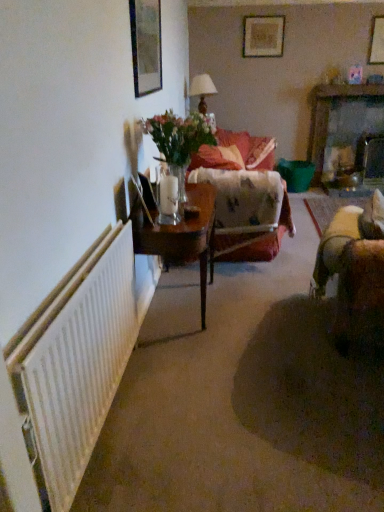
Question: From the image's perspective, would you say wooden picture frame at upper right, acting as the second picture frame starting from the back, is shown under wooden table at left?

Choices:
 (A) yes
 (B) no

Answer: (B)

Question: Is wooden picture frame at upper right, positioned as the 2th picture frame in top-to-bottom order, to the right of wooden table at left from the viewer's perspective?

Choices:
 (A) no
 (B) yes

Answer: (B)

Question: From a real-world perspective, is wooden picture frame at upper right, positioned as the 2th picture frame in top-to-bottom order, physically below wooden table at left?

Choices:
 (A) yes
 (B) no

Answer: (B)

Question: Would you say wooden picture frame at upper right, acting as the second picture frame starting from the back, is outside wooden table at left?

Choices:
 (A) no
 (B) yes

Answer: (B)

Question: From the image's perspective, is wooden picture frame at upper right, positioned as the second picture frame in bottom-to-top order, above wooden table at left?

Choices:
 (A) no
 (B) yes

Answer: (B)

Question: In terms of height, does fluffy fabric couch at center look taller or shorter compared to wooden picture frame at upper center, the 3th picture frame positioned from the front?

Choices:
 (A) tall
 (B) short

Answer: (A)

Question: Is point (274, 147) positioned closer to the camera than point (264, 38)?

Choices:
 (A) closer
 (B) farther

Answer: (B)

Question: From the image's perspective, is fluffy fabric couch at center located above or below wooden picture frame at upper center, the 3th picture frame from the bottom?

Choices:
 (A) above
 (B) below

Answer: (B)

Question: From a real-world perspective, is fluffy fabric couch at center above or below wooden picture frame at upper center, the 3th picture frame positioned from the front?

Choices:
 (A) above
 (B) below

Answer: (B)

Question: Looking at their shapes, would you say white ribbed radiator at left is wider or thinner than wooden picture frame at upper center, placed as the first picture frame when sorted from top to bottom?

Choices:
 (A) wide
 (B) thin

Answer: (A)

Question: From the image's perspective, is white ribbed radiator at left above or below wooden picture frame at upper center, the first picture frame from the back?

Choices:
 (A) above
 (B) below

Answer: (B)

Question: Is point (82, 328) positioned closer to the camera than point (276, 20)?

Choices:
 (A) farther
 (B) closer

Answer: (B)

Question: Is white ribbed radiator at left inside or outside of wooden picture frame at upper center, which ranks as the second picture frame in right-to-left order?

Choices:
 (A) outside
 (B) inside

Answer: (A)

Question: Looking at the image, does fluffy fabric couch at center seem bigger or smaller compared to white ribbed radiator at left?

Choices:
 (A) small
 (B) big

Answer: (B)

Question: In the image, is fluffy fabric couch at center on the left side or the right side of white ribbed radiator at left?

Choices:
 (A) left
 (B) right

Answer: (B)